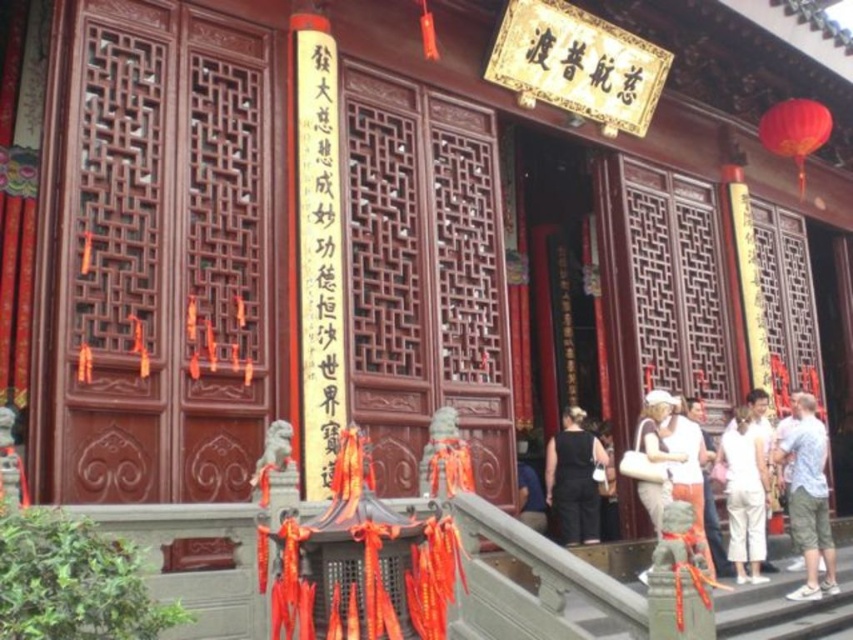
Can you confirm if black paper with gold ink at center is shorter than light blue denim shorts at right?

No.

Can you confirm if black paper with gold ink at center is thinner than light blue denim shorts at right?

Yes.

Between point (297, 211) and point (796, 474), which one is positioned behind?

The point (796, 474) is behind.

This screenshot has height=640, width=853. Identify the location of black paper with gold ink at center. (318, 259).

Does black paper with gold ink at center have a lesser height compared to black fabric dress at lower center?

No.

Is point (306, 282) positioned behind point (575, 449)?

No, it is in front of (575, 449).

The height and width of the screenshot is (640, 853). Identify the location of black paper with gold ink at center. (318, 259).

Is point (808, 492) more distant than point (753, 481)?

No.

The height and width of the screenshot is (640, 853). What are the coordinates of `light blue denim shorts at right` in the screenshot? It's located at (808, 497).